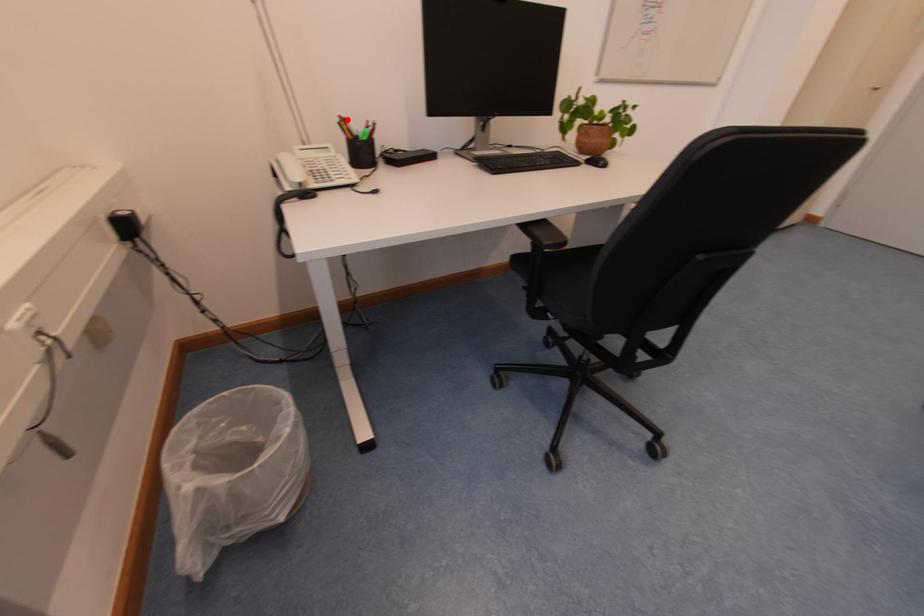
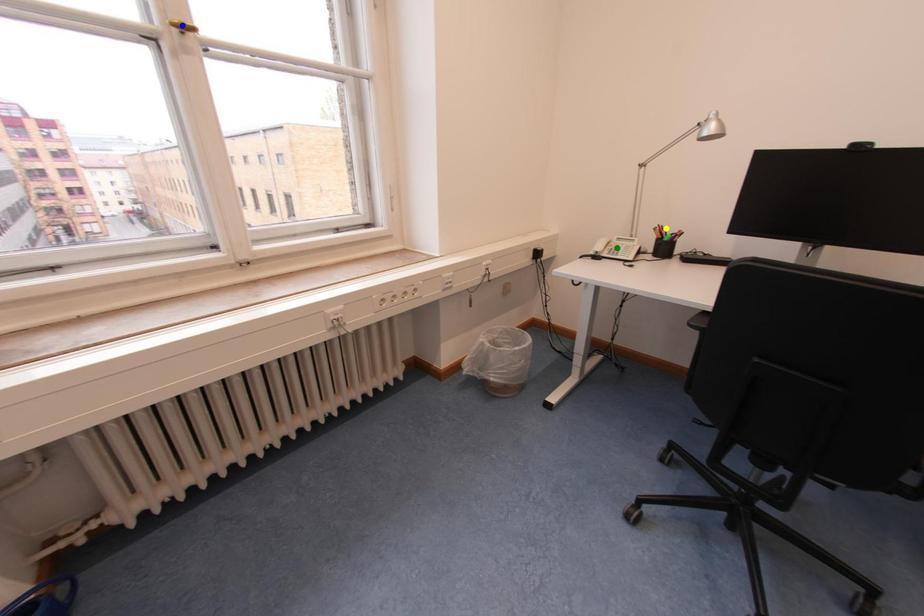
Question: I am providing you with two images of the same scene from different viewpoints. A red point is marked on the first image. You are given multiple points on the second image. Which point in image 2 is actually the same real-world point as the red point in image 1?

Choices:
 (A) green point
 (B) yellow point
 (C) blue point

Answer: (B)